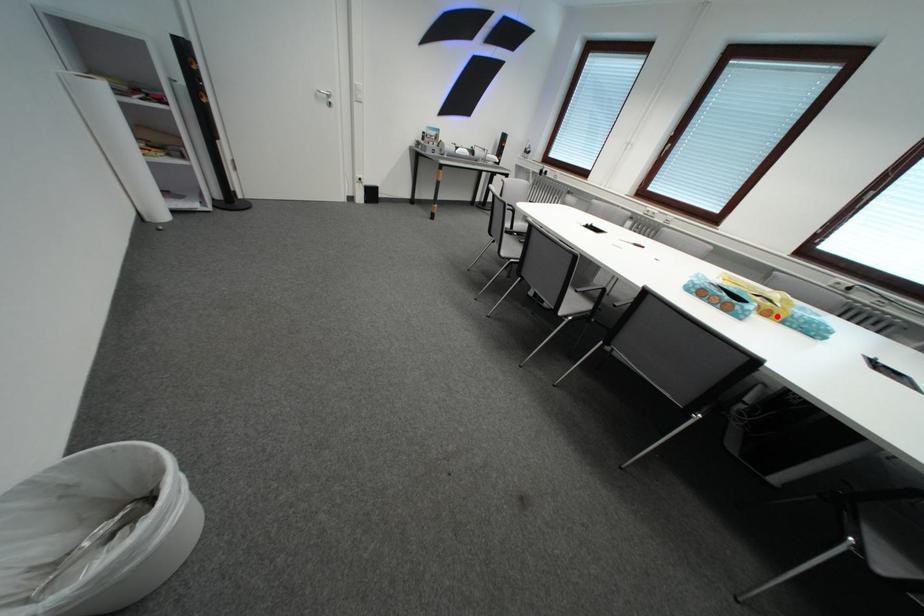
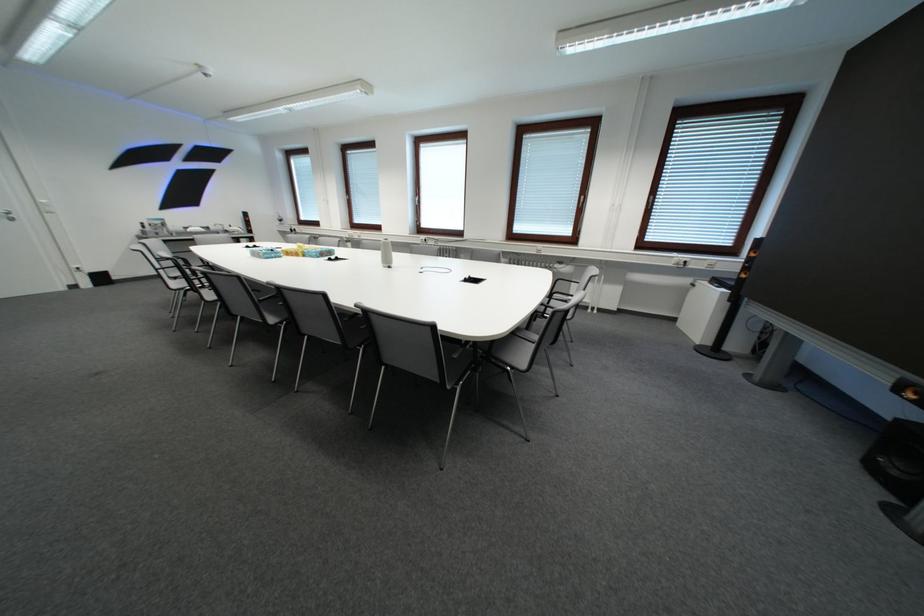
Locate, in the second image, the point that corresponds to the highlighted location in the first image.

(307, 257)